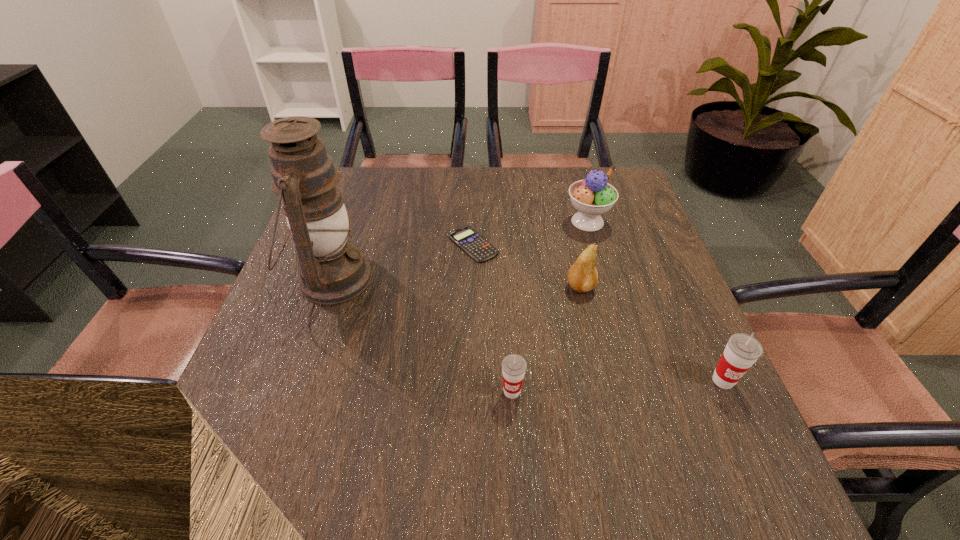
Where is `the left cup`? This screenshot has height=540, width=960. the left cup is located at coordinates (514, 366).

Where is `the taller cup`? This screenshot has width=960, height=540. the taller cup is located at coordinates (742, 350).

Identify the location of the rightmost object. (742, 350).

The image size is (960, 540). In order to click on icecream in this screenshot , I will do `click(593, 196)`.

Identify the location of the shortest object. [476, 246].

The height and width of the screenshot is (540, 960). I want to click on oil lamp, so click(x=332, y=270).

Locate an element on the screen. Image resolution: width=960 pixels, height=540 pixels. the tallest object is located at coordinates (332, 270).

This screenshot has width=960, height=540. In order to click on pear in this screenshot , I will do `click(582, 276)`.

Where is `vacant area located 0.060m on the side of the left cup with the logo`? Image resolution: width=960 pixels, height=540 pixels. vacant area located 0.060m on the side of the left cup with the logo is located at coordinates (515, 433).

Find the location of `free region located 0.210m on the front of the icecream`. free region located 0.210m on the front of the icecream is located at coordinates (609, 294).